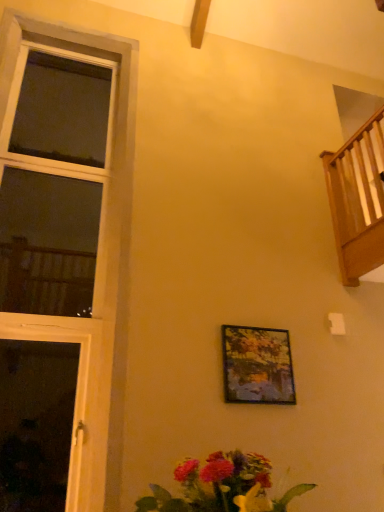
Question: Choose the correct answer: Is wooden railing at upper right inside wooden window at left or outside it?

Choices:
 (A) inside
 (B) outside

Answer: (B)

Question: Looking at the image, does wooden railing at upper right seem bigger or smaller compared to wooden window at left?

Choices:
 (A) small
 (B) big

Answer: (A)

Question: Based on their relative distances, which object is farther from the wooden railing at upper right?

Choices:
 (A) vibrant bouquet at lower center
 (B) wooden window at left
 (C) metallic gold picture frame at center

Answer: (A)

Question: Which object is the closest to the vibrant bouquet at lower center?

Choices:
 (A) metallic gold picture frame at center
 (B) wooden window at left
 (C) wooden railing at upper right

Answer: (A)